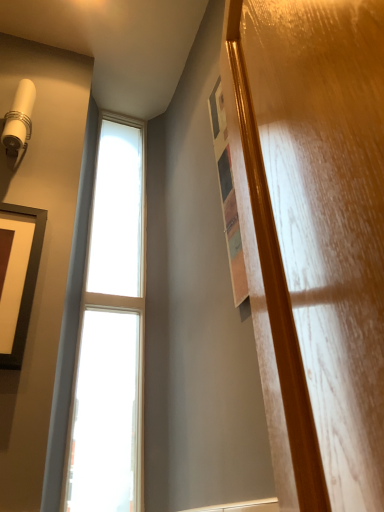
Identify the location of matte black picture frame at left. This screenshot has height=512, width=384. (25, 284).

Image resolution: width=384 pixels, height=512 pixels. Describe the element at coordinates (25, 284) in the screenshot. I see `matte black picture frame at left` at that location.

You are a GUI agent. You are given a task and a screenshot of the screen. Output one action in this format:
    pyautogui.click(x=<x>, y=<y>)
    Task: Click on the clear glass window at left
    The image size is (384, 512).
    Given the screenshot: What is the action you would take?
    pyautogui.click(x=111, y=333)

Measure the distance between point [117,510] and camera.

Point [117,510] and camera are 3.76 feet apart.

Describe the element at coordinates (111, 333) in the screenshot. The image size is (384, 512). I see `clear glass window at left` at that location.

Locate an element on the screen. The height and width of the screenshot is (512, 384). matte black picture frame at left is located at coordinates (25, 284).

Can you confirm if matte black picture frame at left is positioned to the left of clear glass window at left?

Correct, you'll find matte black picture frame at left to the left of clear glass window at left.

Considering their positions, is matte black picture frame at left located in front of or behind clear glass window at left?

In the image, matte black picture frame at left appears in front of clear glass window at left.

Is point (35, 277) positioned after point (91, 244)?

No, it is not.

From the image's perspective, is matte black picture frame at left beneath clear glass window at left?

Yes, from the image's perspective, matte black picture frame at left is beneath clear glass window at left.

Looking at this image, from a real-world perspective, which is physically below, matte black picture frame at left or clear glass window at left?

matte black picture frame at left, from a real-world perspective.

Looking at their sizes, would you say matte black picture frame at left is wider or thinner than clear glass window at left?

matte black picture frame at left is thinner than clear glass window at left.

Considering the relative sizes of matte black picture frame at left and clear glass window at left in the image provided, is matte black picture frame at left taller than clear glass window at left?

Incorrect, the height of matte black picture frame at left is not larger of that of clear glass window at left.

Looking at this image, is matte black picture frame at left bigger or smaller than clear glass window at left?

Clearly, matte black picture frame at left is smaller in size than clear glass window at left.

Is clear glass window at left surrounded by matte black picture frame at left?

No, clear glass window at left is located outside of matte black picture frame at left.

Is matte black picture frame at left not near clear glass window at left?

No, matte black picture frame at left is not far from clear glass window at left.

Is matte black picture frame at left turned away from clear glass window at left?

matte black picture frame at left is not turned away from clear glass window at left.

Locate an element on the screen. This screenshot has height=512, width=384. window located on the right of matte black picture frame at left is located at coordinates (111, 333).

Between clear glass window at left and matte black picture frame at left, which one appears on the right side from the viewer's perspective?

Positioned to the right is clear glass window at left.

Is clear glass window at left closer to the viewer compared to matte black picture frame at left?

That is False.

Considering the points (86, 497) and (14, 336), which point is in front, point (86, 497) or point (14, 336)?

The point (14, 336) is closer to the camera.

From the image's perspective, is clear glass window at left on top of matte black picture frame at left?

Yes, from the image's perspective, clear glass window at left is on top of matte black picture frame at left.

From a real-world perspective, is clear glass window at left on top of matte black picture frame at left?

Yes, from a real-world perspective, clear glass window at left is over matte black picture frame at left

Is clear glass window at left wider or thinner than matte black picture frame at left?

Considering their sizes, clear glass window at left looks broader than matte black picture frame at left.

Looking at this image, which of these two, clear glass window at left or matte black picture frame at left, stands shorter?

Standing shorter between the two is matte black picture frame at left.

Is clear glass window at left smaller than matte black picture frame at left?

Incorrect, clear glass window at left is not smaller in size than matte black picture frame at left.

Is clear glass window at left not inside matte black picture frame at left?

Yes.

Looking at this image, are clear glass window at left and matte black picture frame at left located far from each other?

Actually, clear glass window at left and matte black picture frame at left are a little close together.

Is clear glass window at left turned away from matte black picture frame at left?

clear glass window at left does not have its back to matte black picture frame at left.

In the scene shown: How different are the orientations of clear glass window at left and matte black picture frame at left in degrees?

The angle between the facing direction of clear glass window at left and the facing direction of matte black picture frame at left is 0.593 degrees.

Where is `window that is on the right side of matte black picture frame at left`? The width and height of the screenshot is (384, 512). window that is on the right side of matte black picture frame at left is located at coordinates (111, 333).

Identify the location of window that appears on the right of matte black picture frame at left. The width and height of the screenshot is (384, 512). (111, 333).

Identify the location of window behind the matte black picture frame at left. (111, 333).